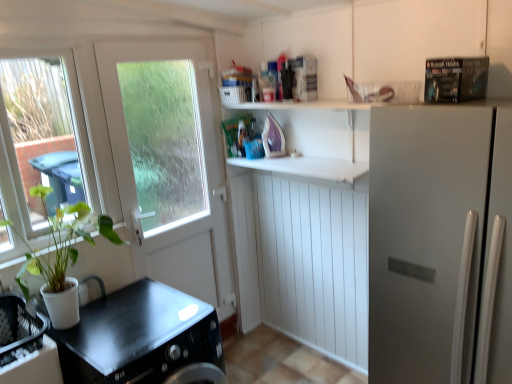
Find the location of a particular element. The height and width of the screenshot is (384, 512). green matte plant at left is located at coordinates (62, 260).

What do you see at coordinates (72, 117) in the screenshot? The image size is (512, 384). I see `clear glass window at left` at bounding box center [72, 117].

What do you see at coordinates (435, 237) in the screenshot? I see `white matte refrigerator at right` at bounding box center [435, 237].

I want to click on white matte door at upper left, so click(202, 171).

You are a GUI agent. You are given a task and a screenshot of the screen. Output one action in this format:
    pyautogui.click(x=<x>, y=<y>)
    Task: Click on the window on the left of black matte countertop at lower left, which ranks as the 2th counter top in right-to-left order
    The width and height of the screenshot is (512, 384).
    Given the screenshot: What is the action you would take?
    pyautogui.click(x=72, y=117)

Is black matte countertop at lower left, acting as the first counter top starting from the bottom, behind clear glass window at left?

No, black matte countertop at lower left, acting as the first counter top starting from the bottom, is in front of clear glass window at left.

Do you think black matte countertop at lower left, the 2th counter top in the top-to-bottom sequence, is within clear glass window at left, or outside of it?

black matte countertop at lower left, the 2th counter top in the top-to-bottom sequence, lies outside clear glass window at left.

Looking at their sizes, would you say metallic silver magazine at upper right is wider or thinner than green matte plant at left?

Considering their sizes, metallic silver magazine at upper right looks slimmer than green matte plant at left.

Is metallic silver magazine at upper right positioned with its back to green matte plant at left?

metallic silver magazine at upper right is not turned away from green matte plant at left.

From a real-world perspective, between metallic silver magazine at upper right and green matte plant at left, who is vertically lower?

In real-world perspective, green matte plant at left is lower.

Considering the relative positions of metallic silver magazine at upper right and green matte plant at left in the image provided, is metallic silver magazine at upper right behind green matte plant at left?

No, metallic silver magazine at upper right is closer to the viewer.

From the image's perspective, does white matte door at upper left appear lower than green matte plant at left?

No, from the image's perspective, white matte door at upper left is not beneath green matte plant at left.

Based on the photo, considering the sizes of objects white matte door at upper left and green matte plant at left in the image provided, who is smaller, white matte door at upper left or green matte plant at left?

Smaller between the two is green matte plant at left.

From a real-world perspective, which is physically below, white matte door at upper left or green matte plant at left?

In real-world perspective, white matte door at upper left is lower.

Is there a large distance between black matte countertop at lower left, the 2th counter top in the top-to-bottom sequence, and metallic silver magazine at upper right?

Indeed, black matte countertop at lower left, the 2th counter top in the top-to-bottom sequence, is not near metallic silver magazine at upper right.

From the image's perspective, is black matte countertop at lower left, which ranks as the 2th counter top in right-to-left order, located above or below metallic silver magazine at upper right?

Clearly, from the image's perspective, black matte countertop at lower left, which ranks as the 2th counter top in right-to-left order, is below metallic silver magazine at upper right.

Is black matte countertop at lower left, which ranks as the 2th counter top in right-to-left order, inside or outside of metallic silver magazine at upper right?

The correct answer is: outside.

Locate an element on the screen. The image size is (512, 384). appliance above the black matte countertop at lower left, which ranks as the 2th counter top in right-to-left order (from the image's perspective) is located at coordinates (455, 79).

Considering the relative sizes of green matte plant at left and white matte door at upper left in the image provided, is green matte plant at left taller than white matte door at upper left?

No, green matte plant at left is not taller than white matte door at upper left.

Which object is positioned more to the right, green matte plant at left or white matte door at upper left?

Positioned to the right is white matte door at upper left.

In terms of width, does green matte plant at left look wider or thinner when compared to white matte door at upper left?

In the image, green matte plant at left appears to be wider than white matte door at upper left.

From a real-world perspective, is green matte plant at left physically above white matte door at upper left?

Yes, from a real-world perspective, green matte plant at left is above white matte door at upper left.

Does white matte refrigerator at right have a greater height compared to white matte counter top at center, arranged as the second counter top when ordered from the bottom?

Correct, white matte refrigerator at right is much taller as white matte counter top at center, arranged as the second counter top when ordered from the bottom.

From a real-world perspective, is white matte refrigerator at right above or below white matte counter top at center, the second counter top positioned from the left?

white matte refrigerator at right is situated lower than white matte counter top at center, the second counter top positioned from the left, in the real world.

Is white matte refrigerator at right positioned far away from white matte counter top at center, the second counter top positioned from the left?

Yes, white matte refrigerator at right and white matte counter top at center, the second counter top positioned from the left, are located far from each other.

Which is more to the right, clear glass window at left or white matte refrigerator at right?

From the viewer's perspective, white matte refrigerator at right appears more on the right side.

From the picture: Who is shorter, clear glass window at left or white matte refrigerator at right?

clear glass window at left.

From the image's perspective, which one is positioned lower, clear glass window at left or white matte refrigerator at right?

white matte refrigerator at right appears lower in the image.

Can you see clear glass window at left touching white matte refrigerator at right?

No, clear glass window at left is not touching white matte refrigerator at right.

The height and width of the screenshot is (384, 512). Find the location of `counter top that is in front of the clear glass window at left`. counter top that is in front of the clear glass window at left is located at coordinates (143, 339).

In the image, there is a green matte plant at left. In order to click on appliance above it (from the image's perspective) in this screenshot , I will do `click(455, 79)`.

Considering their positions, is clear glass window at left positioned further to white matte refrigerator at right than black matte countertop at lower left, acting as the first counter top starting from the bottom?

clear glass window at left.

Looking at the image, which one is located further to white matte refrigerator at right, white matte door at upper left or metallic silver magazine at upper right?

white matte door at upper left lies further to white matte refrigerator at right than the other object.

In the scene shown: Looking at the image, which one is located further to metallic silver magazine at upper right, clear glass window at left or black matte countertop at lower left, the 2th counter top in the top-to-bottom sequence?

clear glass window at left is further to metallic silver magazine at upper right.

Considering their positions, is green matte plant at left positioned further to white matte door at upper left than white matte counter top at center, arranged as the second counter top when ordered from the bottom?

Based on the image, green matte plant at left appears to be further to white matte door at upper left.

Looking at the image, which one is located further to clear glass window at left, black matte countertop at lower left, which ranks as the 2th counter top in right-to-left order, or white matte refrigerator at right?

The object further to clear glass window at left is white matte refrigerator at right.

From the image, which object appears to be nearer to clear glass window at left, white matte door at upper left or white matte refrigerator at right?

white matte door at upper left.

From the image, which object appears to be farther from white matte door at upper left, black matte countertop at lower left, acting as the first counter top starting from the bottom, or white matte counter top at center, the first counter top in the right-to-left sequence?

Based on the image, black matte countertop at lower left, acting as the first counter top starting from the bottom, appears to be further to white matte door at upper left.

Estimate the real-world distances between objects in this image. Which object is closer to white matte counter top at center, arranged as the second counter top when ordered from the bottom, black matte countertop at lower left, arranged as the 1th counter top when viewed from the left, or green matte plant at left?

black matte countertop at lower left, arranged as the 1th counter top when viewed from the left, is closer to white matte counter top at center, arranged as the second counter top when ordered from the bottom.

Locate an element on the screen. The image size is (512, 384). door situated between clear glass window at left and white matte counter top at center, the first counter top in the right-to-left sequence, from left to right is located at coordinates (202, 171).

Locate an element on the screen. This screenshot has width=512, height=384. counter top located between black matte countertop at lower left, the 2th counter top in the top-to-bottom sequence, and white matte refrigerator at right in the left-right direction is located at coordinates (306, 167).

At what (x,y) coordinates should I click in order to perform the action: click on houseplant between white matte door at upper left and black matte countertop at lower left, which ranks as the 2th counter top in right-to-left order, from top to bottom. Please return your answer as a coordinate pair (x, y). This screenshot has width=512, height=384. Looking at the image, I should click on (62, 260).

At what (x,y) coordinates should I click in order to perform the action: click on door between green matte plant at left and white matte refrigerator at right in the horizontal direction. Please return your answer as a coordinate pair (x, y). This screenshot has width=512, height=384. Looking at the image, I should click on (202, 171).